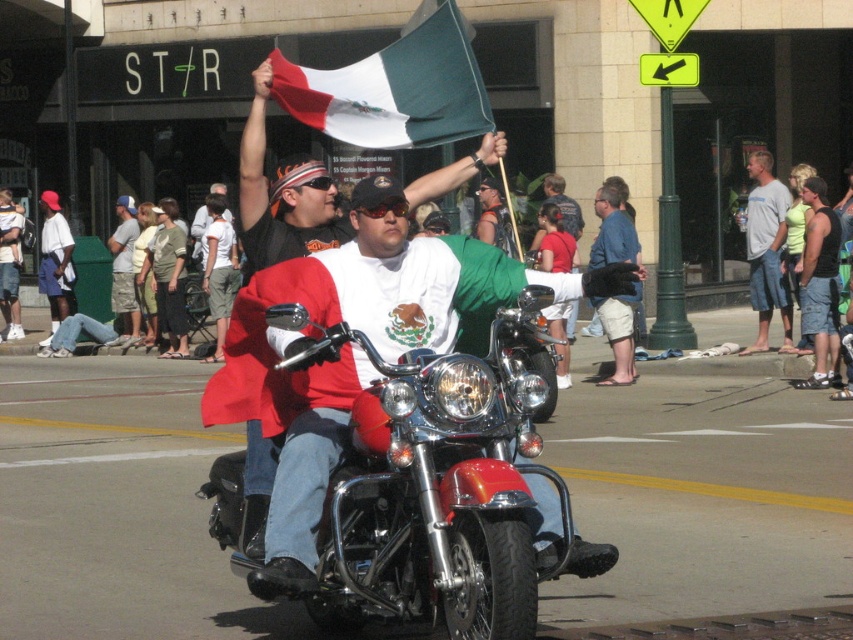
Between matte black motorcycle at center and beige shorts at center, which one has more height?

With more height is beige shorts at center.

Does matte black motorcycle at center have a larger size compared to beige shorts at center?

No.

Locate an element on the screen. The width and height of the screenshot is (853, 640). matte black motorcycle at center is located at coordinates (283, 195).

Between shiny chrome motorcycle at center and green felt flag at upper center, which one has more height?

With more height is shiny chrome motorcycle at center.

Does shiny chrome motorcycle at center have a greater height compared to green felt flag at upper center?

Yes.

Who is more forward, (277, 316) or (299, 100)?

Point (277, 316)

The image size is (853, 640). I want to click on shiny chrome motorcycle at center, so click(x=431, y=488).

Is matte black motorcycle at center wider than denim shorts at center?

In fact, matte black motorcycle at center might be narrower than denim shorts at center.

Is matte black motorcycle at center taller than denim shorts at center?

No, matte black motorcycle at center is not taller than denim shorts at center.

The image size is (853, 640). Describe the element at coordinates (283, 195) in the screenshot. I see `matte black motorcycle at center` at that location.

At what (x,y) coordinates should I click in order to perform the action: click on matte black motorcycle at center. Please return your answer as a coordinate pair (x, y). Looking at the image, I should click on (283, 195).